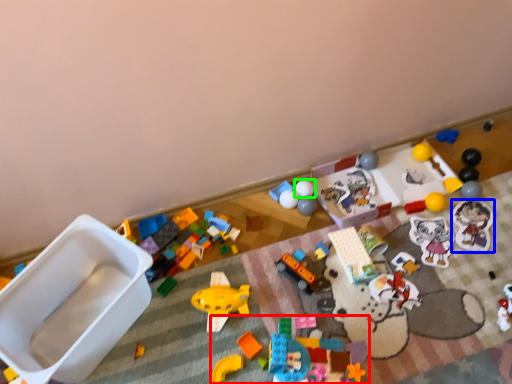
Question: Estimate the real-world distances between objects in this image. Which object is closer to toy (highlighted by a red box), toy (highlighted by a blue box) or toy (highlighted by a green box)?

Choices:
 (A) toy
 (B) toy

Answer: (B)